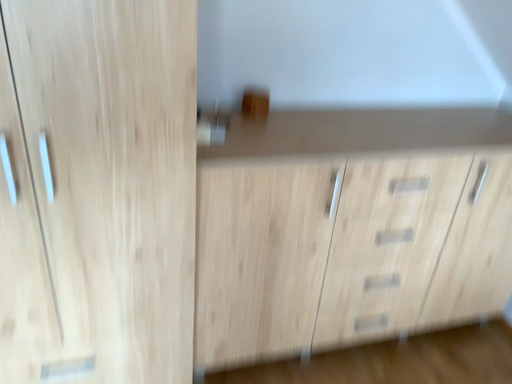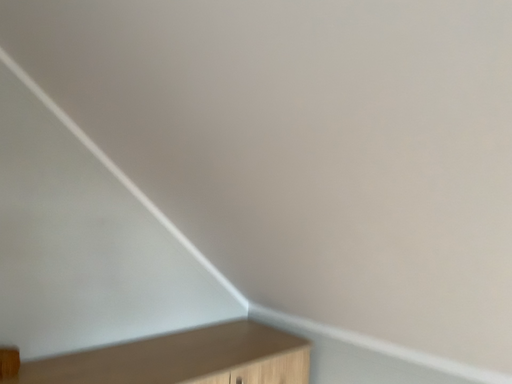
Question: How did the camera likely rotate when shooting the video?

Choices:
 (A) rotated right
 (B) rotated left

Answer: (A)